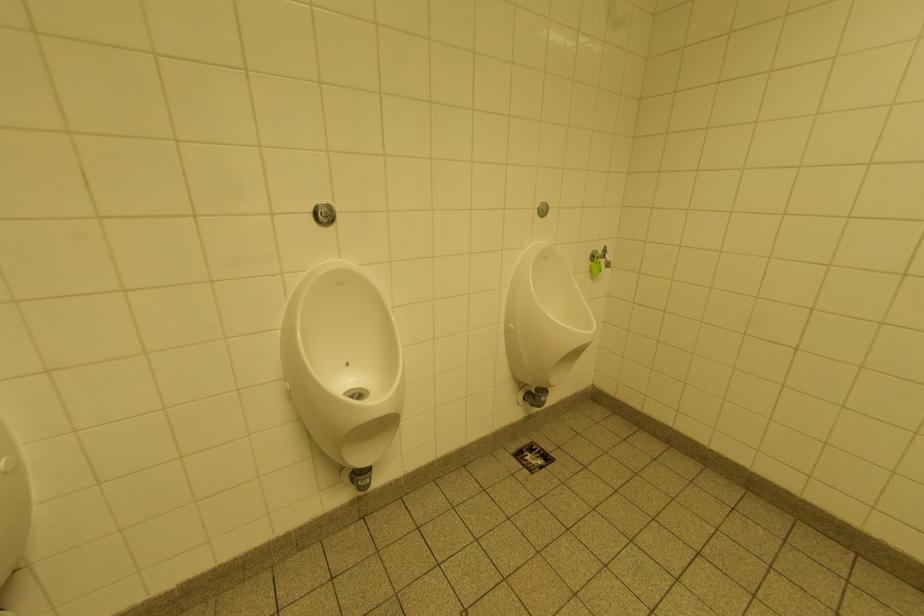
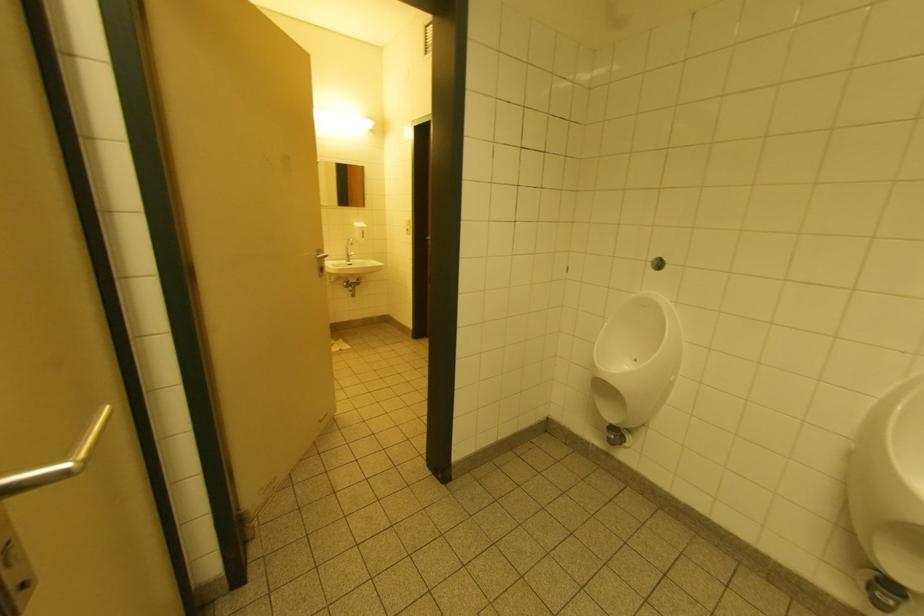
Question: The camera is either moving clockwise (left) or counter-clockwise (right) around the object. The first image is from the beginning of the video and the second image is from the end. Is the camera moving left or right when shooting the video?

Choices:
 (A) Left
 (B) Right

Answer: (B)